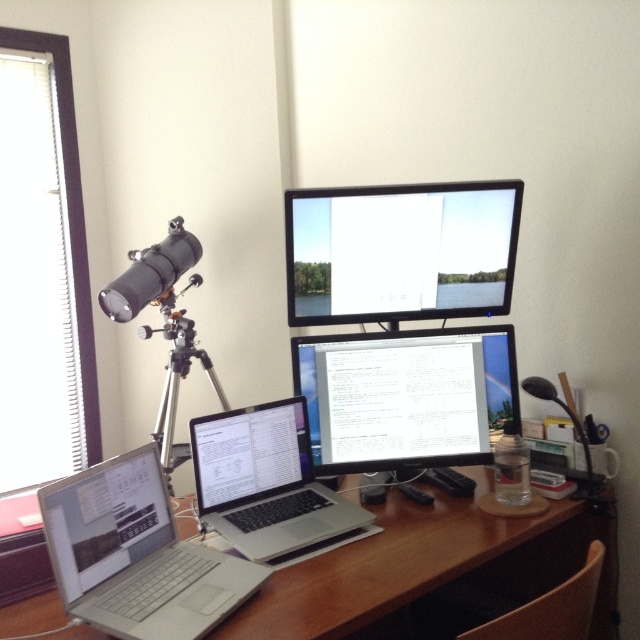
Which is behind, point (561, 547) or point (300, 506)?

The point (561, 547) is behind.

Consider the image. Can you confirm if wooden at center is smaller than silver metallic laptop at center?

No.

Locate an element on the screen. The height and width of the screenshot is (640, 640). wooden at center is located at coordinates (429, 566).

In the scene shown: Does wooden at center appear on the right side of matte black monitor at center?

No, wooden at center is not to the right of matte black monitor at center.

Which is in front, point (349, 598) or point (420, 385)?

Point (349, 598)

Find the location of a particular element. The width and height of the screenshot is (640, 640). wooden at center is located at coordinates (429, 566).

Which is more to the right, wooden at center or silver metallic laptop at lower left?

wooden at center

Who is taller, wooden at center or silver metallic laptop at lower left?

wooden at center is taller.

Between point (378, 552) and point (230, 598), which one is positioned in front?

Point (230, 598)

Locate an element on the screen. wooden at center is located at coordinates click(x=429, y=566).